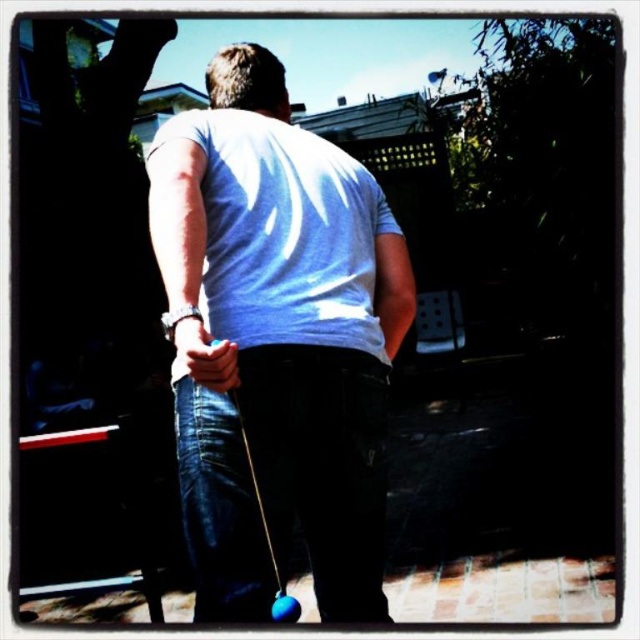
Is the position of white matte t-shirt at center more distant than that of matte blue ball at center?

That is True.

Who is positioned more to the right, white matte t-shirt at center or matte blue ball at center?

Positioned to the right is white matte t-shirt at center.

Find the location of a particular element. white matte t-shirt at center is located at coordinates (291, 308).